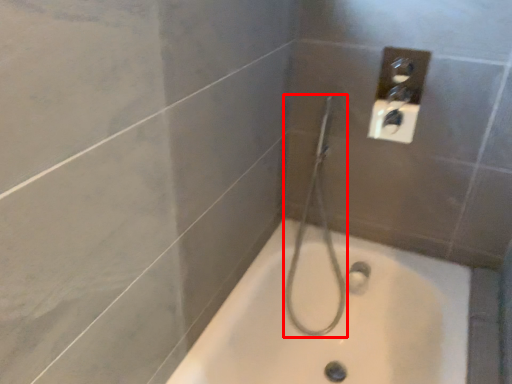
Question: Considering the relative positions of shower (annotated by the red box) and bathtub in the image provided, where is shower (annotated by the red box) located with respect to the staircase?

Choices:
 (A) left
 (B) right

Answer: (A)